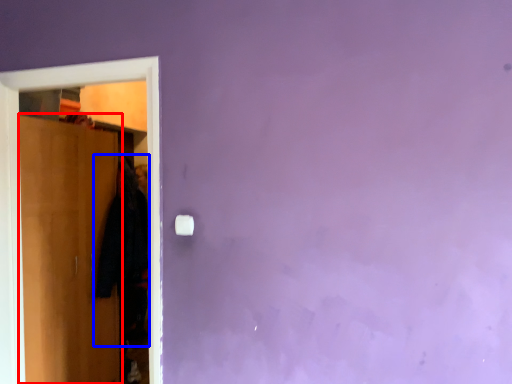
Question: Which of the following is the farthest to the observer, door (highlighted by a red box) or clothing (highlighted by a blue box)?

Choices:
 (A) door
 (B) clothing

Answer: (B)